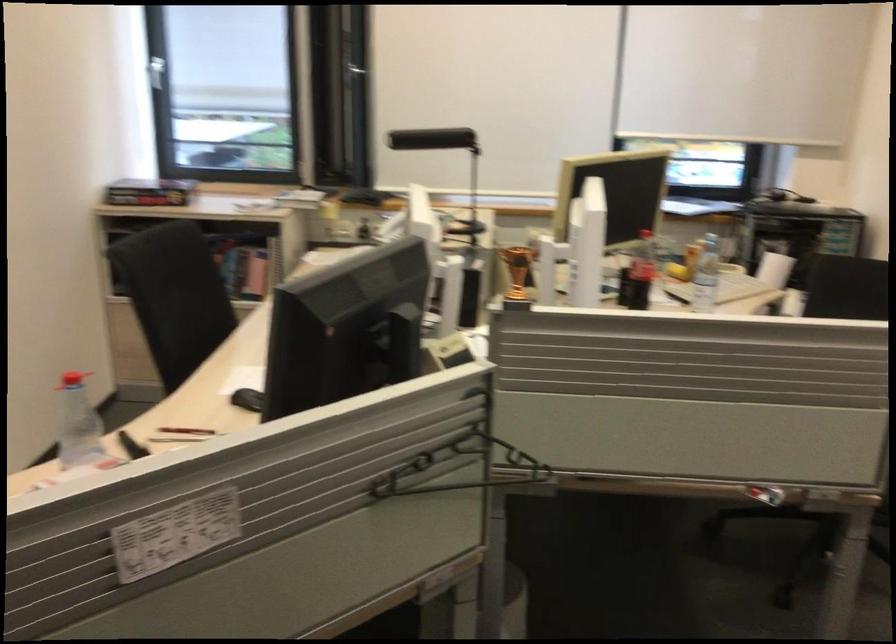
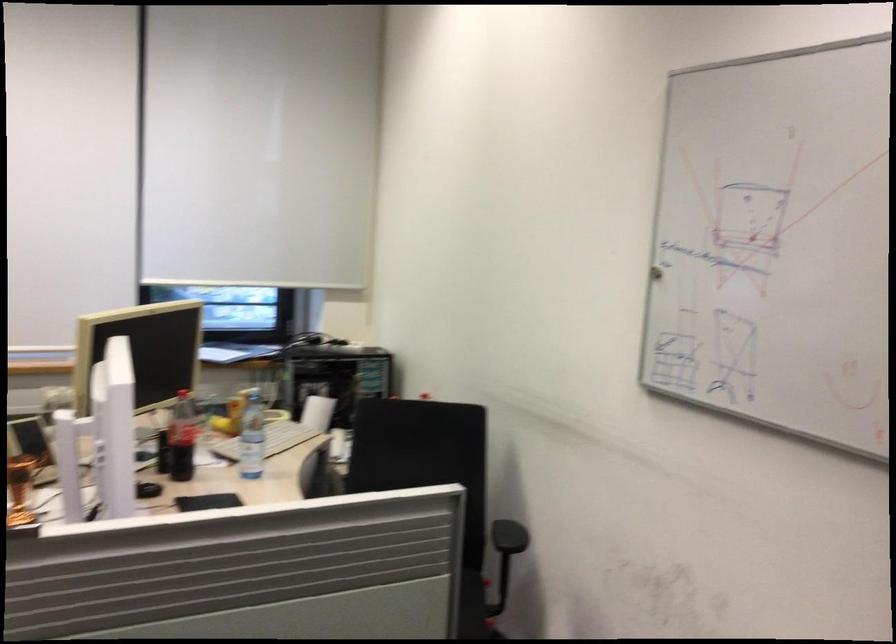
Find the pixel in the second image that matches (x=645, y=272) in the first image.

(182, 438)